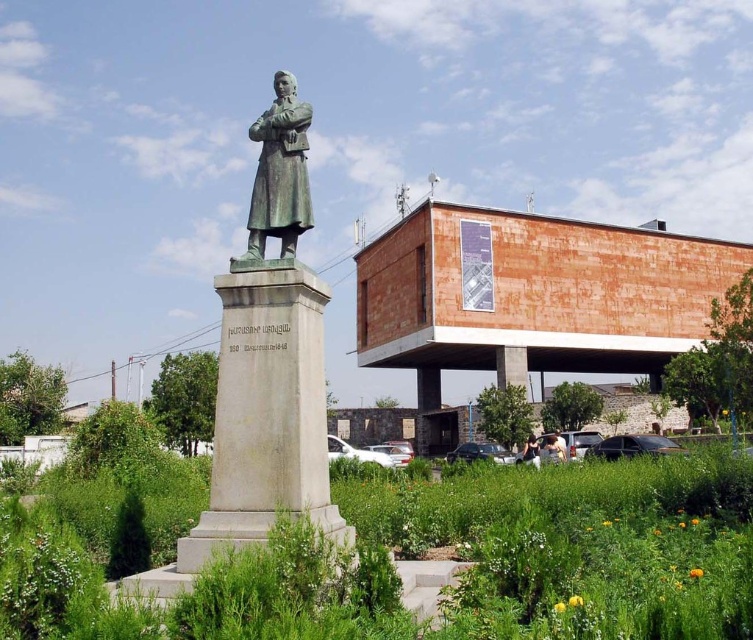
Question: Which point is closer to the camera?

Choices:
 (A) (264, 205)
 (B) (546, 458)
 (C) (520, 451)

Answer: (A)

Question: Which object is the farthest from the light brown leather jacket at lower center?

Choices:
 (A) green bronze statue at center
 (B) bronze statue at center

Answer: (A)

Question: Can you confirm if green bronze statue at center is positioned above white fabric person at center?

Choices:
 (A) no
 (B) yes

Answer: (B)

Question: Is green bronze statue at center wider than light brown leather jacket at lower center?

Choices:
 (A) no
 (B) yes

Answer: (A)

Question: Does green bronze statue at center appear on the left side of bronze statue at center?

Choices:
 (A) yes
 (B) no

Answer: (B)

Question: Estimate the real-world distances between objects in this image. Which object is farther from the white fabric person at center?

Choices:
 (A) bronze statue at center
 (B) green bronze statue at center
 (C) light brown leather jacket at lower center

Answer: (B)